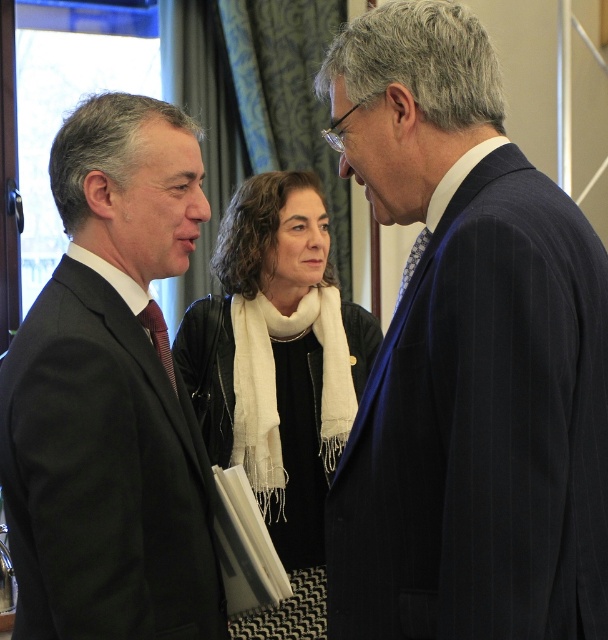
Is dark blue pinstripe suit at right positioned in front of white scarf at center?

Yes.

Is dark blue pinstripe suit at right wider than white scarf at center?

No, dark blue pinstripe suit at right is not wider than white scarf at center.

Identify the location of dark blue pinstripe suit at right. (468, 358).

Is black suit at left behind white scarf at center?

No, it is not.

Which is behind, point (128, 100) or point (306, 465)?

Positioned behind is point (306, 465).

At what (x,y) coordinates should I click in order to perform the action: click on black suit at left. Please return your answer as a coordinate pair (x, y). This screenshot has height=640, width=608. Looking at the image, I should click on (111, 396).

Is dark blue pinstripe suit at right thinner than black suit at left?

In fact, dark blue pinstripe suit at right might be wider than black suit at left.

This screenshot has width=608, height=640. Describe the element at coordinates (468, 358) in the screenshot. I see `dark blue pinstripe suit at right` at that location.

Find the location of a particular element. This screenshot has height=640, width=608. dark blue pinstripe suit at right is located at coordinates (468, 358).

This screenshot has width=608, height=640. In order to click on dark blue pinstripe suit at right in this screenshot , I will do `click(468, 358)`.